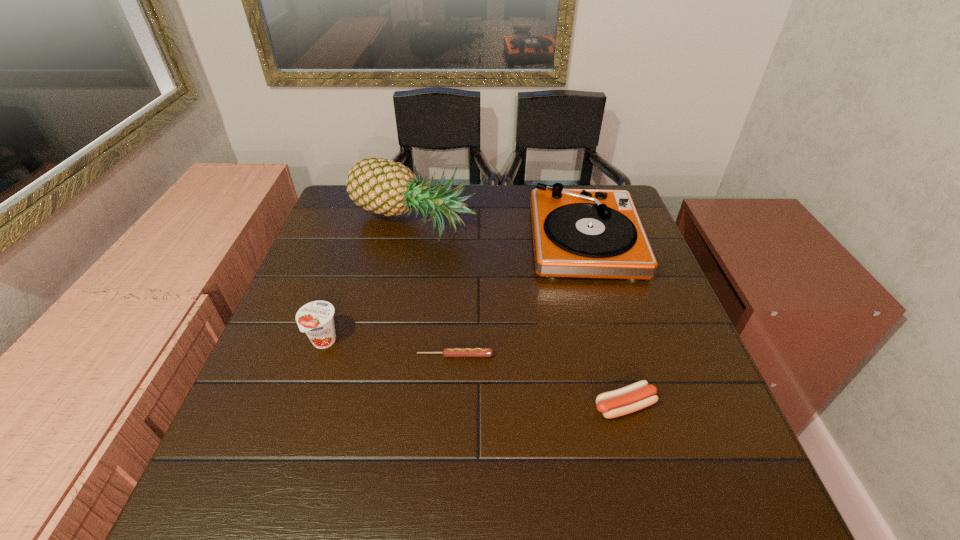
Identify the location of unoccupied position between the pineapple and the third shortest object. click(368, 283).

Locate an element on the screen. free space that is in between the tallest object and the nearer sausage is located at coordinates (518, 315).

Locate an element on the screen. This screenshot has width=960, height=540. unoccupied area between the farther sausage and the yogurt is located at coordinates (390, 349).

This screenshot has width=960, height=540. Identify the location of free space between the pineapple and the third tallest object. (368, 283).

Locate an element on the screen. The height and width of the screenshot is (540, 960). object that stands as the second closest to the third shortest object is located at coordinates (382, 186).

Identify the location of object that ranks as the third closest to the shortest object. The width and height of the screenshot is (960, 540). (585, 233).

Locate an element on the screen. free space in the image that satisfies the following two spatial constraints: 1. on the front side of the fourth tallest object; 2. on the left side of the shortest object is located at coordinates coord(453,406).

Locate an element on the screen. The image size is (960, 540). vacant area that satisfies the following two spatial constraints: 1. on the back side of the yogurt; 2. on the left side of the record player is located at coordinates (358, 240).

Identify the location of free point that satisfies the following two spatial constraints: 1. on the front side of the third tallest object; 2. on the left side of the taller sausage. (301, 406).